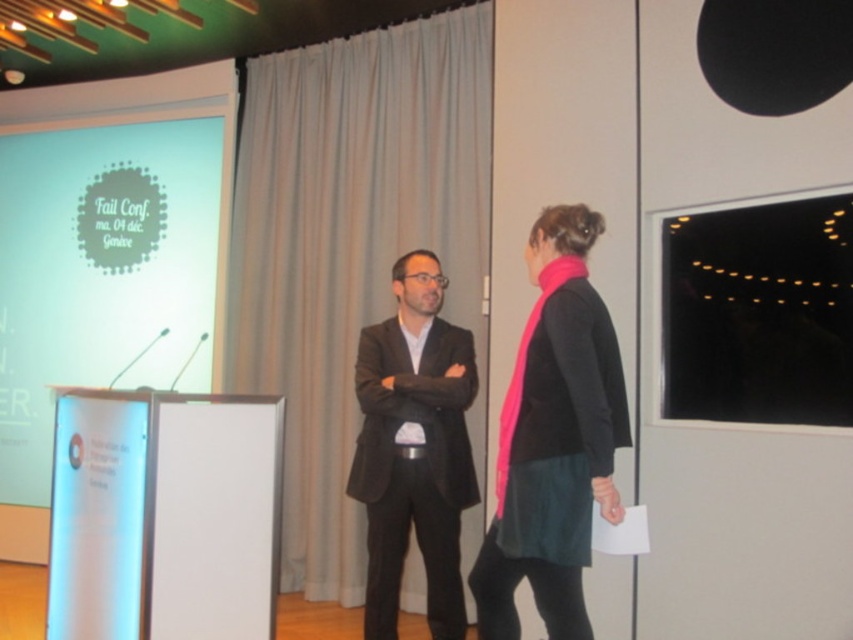
Question: Which object appears farthest from the camera in this image?

Choices:
 (A) pink matte scarf at right
 (B) matte black suit at center
 (C) white glossy projection screen at upper left
 (D) black matte projection screen at upper right

Answer: (C)

Question: Which of the following is the closest to the observer?

Choices:
 (A) black matte projection screen at upper right
 (B) pink matte scarf at right
 (C) white glossy projection screen at upper left

Answer: (B)

Question: Where is white glossy projection screen at upper left located in relation to matte black suit at center in the image?

Choices:
 (A) right
 (B) left

Answer: (B)

Question: Is white glossy projection screen at upper left wider than pink matte scarf at right?

Choices:
 (A) yes
 (B) no

Answer: (A)

Question: Is black matte projection screen at upper right thinner than matte black suit at center?

Choices:
 (A) no
 (B) yes

Answer: (B)

Question: Which object is closer to the camera taking this photo?

Choices:
 (A) pink matte scarf at right
 (B) matte black suit at center
 (C) black matte projection screen at upper right
 (D) white glossy projection screen at upper left

Answer: (A)